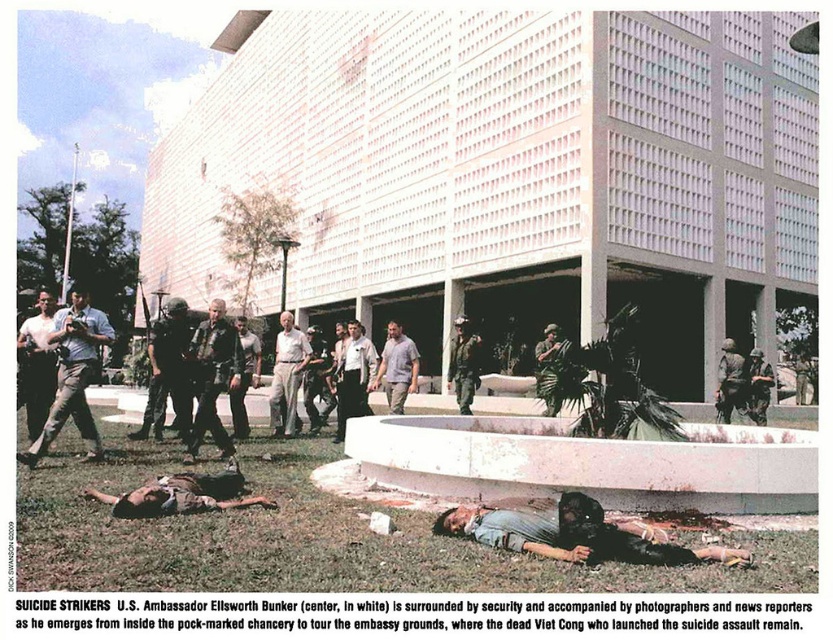
Question: Which of the following is the farthest from the observer?

Choices:
 (A) (195, 502)
 (B) (449, 349)
 (C) (742, 365)

Answer: (B)

Question: Can you confirm if matte black camera at left is positioned above dark brown leather jacket at center?

Choices:
 (A) no
 (B) yes

Answer: (B)

Question: Which point is farther from the camera taking this photo?

Choices:
 (A) (200, 358)
 (B) (233, 397)

Answer: (B)

Question: Considering the relative positions of dark brown leather jacket at center and dark brown leather jacket at lower left in the image provided, where is dark brown leather jacket at center located with respect to dark brown leather jacket at lower left?

Choices:
 (A) right
 (B) left

Answer: (B)

Question: Which of these objects is positioned farthest from the white uniformed person at center?

Choices:
 (A) matte black camera at left
 (B) camouflage uniform at center
 (C) matte black helmet at center

Answer: (A)

Question: Observing the image, what is the correct spatial positioning of green grass at lower center in reference to matte black camera at left?

Choices:
 (A) left
 (B) right

Answer: (B)